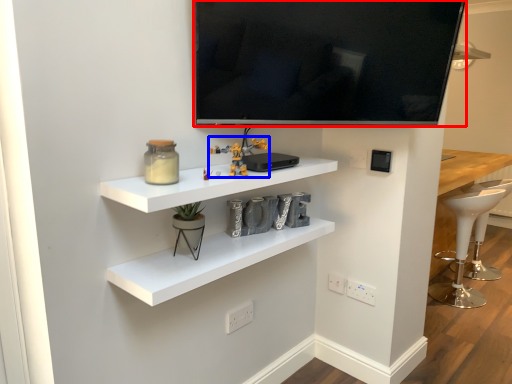
Question: Among these objects, which one is farthest to the camera, television (highlighted by a red box) or toy (highlighted by a blue box)?

Choices:
 (A) television
 (B) toy

Answer: (B)